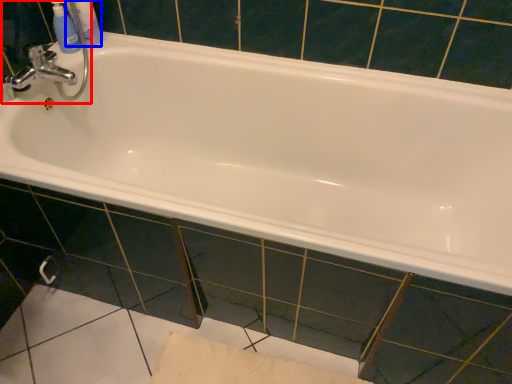
Question: Which object is closer to the camera taking this photo, sink (highlighted by a red box) or toiletry (highlighted by a blue box)?

Choices:
 (A) sink
 (B) toiletry

Answer: (A)